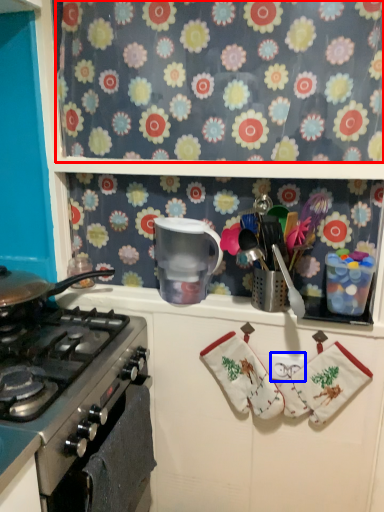
Question: Which point is further to the camera, flower (highlighted by a red box) or tile (highlighted by a blue box)?

Choices:
 (A) flower
 (B) tile

Answer: (B)